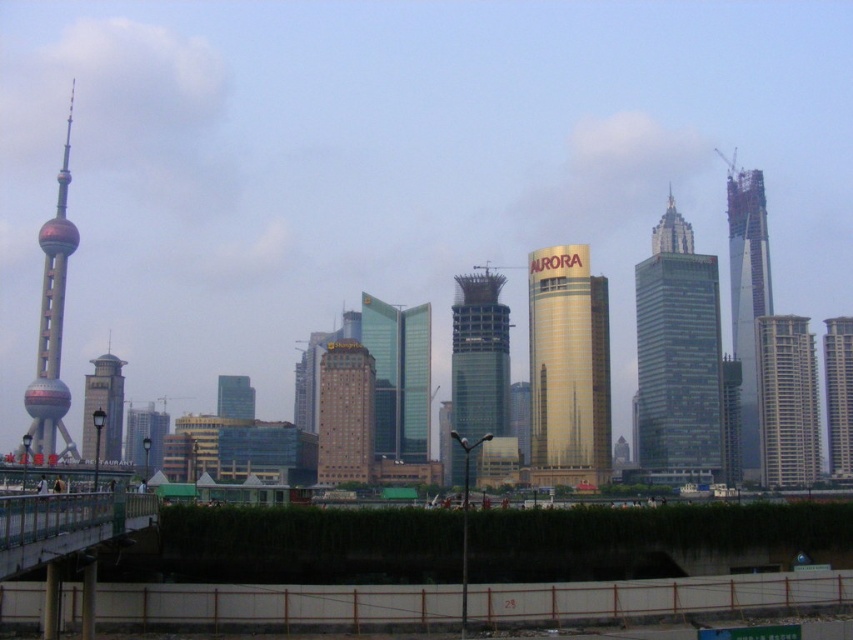
Find the location of a particular element. The height and width of the screenshot is (640, 853). glassy reflective skyscraper at center is located at coordinates (399, 376).

Which of these two, glassy reflective skyscraper at center or transparent glass skyscraper at right, stands taller?

With more height is transparent glass skyscraper at right.

Measure the distance between point (363,304) and camera.

They are 1311.05 feet apart.

The image size is (853, 640). Find the location of `glassy reflective skyscraper at center`. glassy reflective skyscraper at center is located at coordinates (399, 376).

Image resolution: width=853 pixels, height=640 pixels. Describe the element at coordinates (479, 356) in the screenshot. I see `glassy skyscraper at center` at that location.

Which of these two, glassy skyscraper at center or glassy reflective skyscraper at center, stands shorter?

With less height is glassy reflective skyscraper at center.

The width and height of the screenshot is (853, 640). What are the coordinates of `glassy skyscraper at center` in the screenshot? It's located at (479, 356).

Who is more forward, (430, 390) or (839, 388)?

Positioned in front is point (430, 390).

Does glassy reflective skyscraper at center have a greater height compared to gold glass skyscraper at right?

In fact, glassy reflective skyscraper at center may be shorter than gold glass skyscraper at right.

Between point (427, 456) and point (849, 381), which one is positioned behind?

The point (849, 381) is behind.

Identify the location of glassy reflective skyscraper at center. The image size is (853, 640). (399, 376).